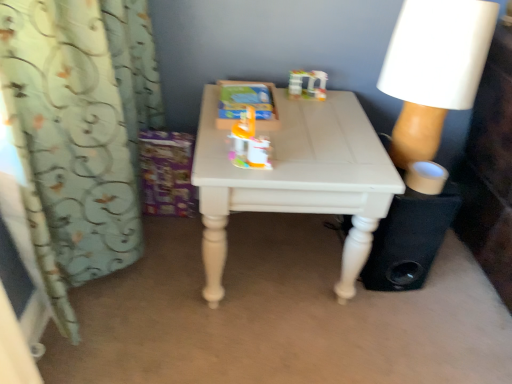
Question: Is orange plastic toy at center, positioned as the 2th toy in top-to-bottom order, not close to light blue fabric curtain at left?

Choices:
 (A) yes
 (B) no

Answer: (B)

Question: From the image's perspective, would you say orange plastic toy at center, which is the 2th toy in back-to-front order, is shown under light blue fabric curtain at left?

Choices:
 (A) yes
 (B) no

Answer: (B)

Question: From a real-world perspective, is orange plastic toy at center, positioned as the 2th toy in right-to-left order, positioned under light blue fabric curtain at left based on gravity?

Choices:
 (A) no
 (B) yes

Answer: (A)

Question: Considering the relative sizes of orange plastic toy at center, positioned as the 2th toy in right-to-left order, and light blue fabric curtain at left in the image provided, is orange plastic toy at center, positioned as the 2th toy in right-to-left order, bigger than light blue fabric curtain at left?

Choices:
 (A) no
 (B) yes

Answer: (A)

Question: Is orange plastic toy at center, which is the first toy in bottom-to-top order, in front of light blue fabric curtain at left?

Choices:
 (A) no
 (B) yes

Answer: (A)

Question: Does orange plastic toy at center, positioned as the 2th toy in right-to-left order, have a smaller size compared to light blue fabric curtain at left?

Choices:
 (A) no
 (B) yes

Answer: (B)

Question: Is white painted wood table at center completely or partially outside of black fabric speaker at lower right?

Choices:
 (A) yes
 (B) no

Answer: (A)

Question: From a real-world perspective, is white painted wood table at center physically above black fabric speaker at lower right?

Choices:
 (A) no
 (B) yes

Answer: (B)

Question: Can you see white painted wood table at center touching black fabric speaker at lower right?

Choices:
 (A) yes
 (B) no

Answer: (B)

Question: Is black fabric speaker at lower right at the back of white painted wood table at center?

Choices:
 (A) no
 (B) yes

Answer: (A)

Question: Considering the relative sizes of white painted wood table at center and black fabric speaker at lower right in the image provided, is white painted wood table at center taller than black fabric speaker at lower right?

Choices:
 (A) yes
 (B) no

Answer: (A)

Question: Is white painted wood table at center oriented towards black fabric speaker at lower right?

Choices:
 (A) yes
 (B) no

Answer: (B)

Question: Considering the relative sizes of black fabric speaker at lower right and orange plastic toy at center, positioned as the 2th toy in top-to-bottom order, in the image provided, is black fabric speaker at lower right wider than orange plastic toy at center, positioned as the 2th toy in top-to-bottom order,?

Choices:
 (A) yes
 (B) no

Answer: (A)